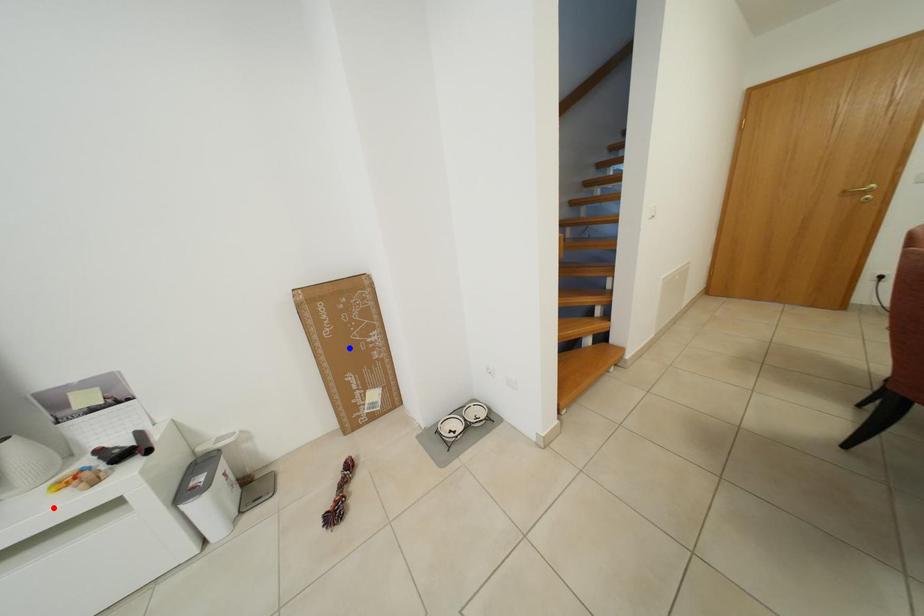
Question: Which of the two points in the image is closer to the camera?

Choices:
 (A) Blue point is closer.
 (B) Red point is closer.

Answer: (B)